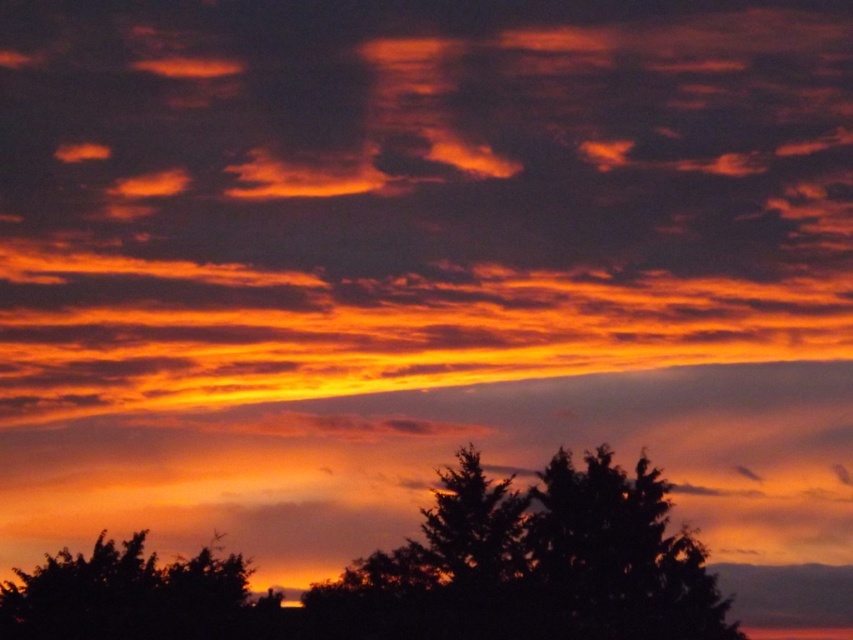
You are standing in a field looking at the sunset. You see two silhouette tree at lower center and silhouette tree at lower left. Which tree is positioned to the right side?

The silhouette tree at lower center is positioned to the right of the silhouette tree at lower left.

Consider the image. You are standing at the camera position and want to reach the point marked as point [13,611]. If you walk straight towards it, how far will you have to walk in feet?

You will have to walk 473.65 feet to reach point [13,611] from the camera position.